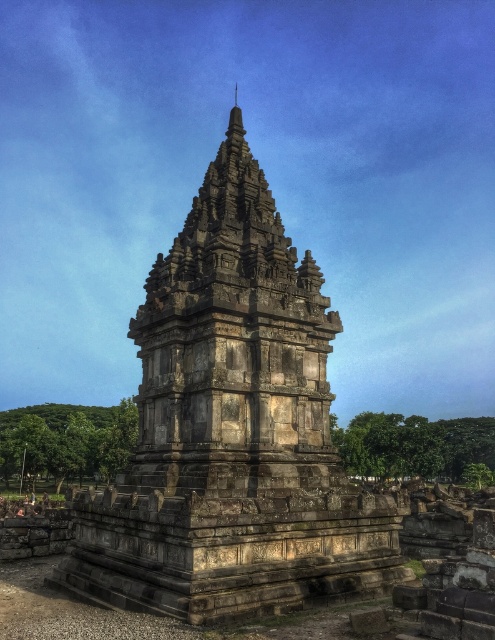
Question: Which of the following is the closest to the observer?

Choices:
 (A) (106, 518)
 (B) (323, 380)

Answer: (A)

Question: From the image, what is the correct spatial relationship of stone temple at center in relation to gray stone tower at center?

Choices:
 (A) above
 (B) below

Answer: (B)

Question: Considering the relative positions of stone temple at center and gray stone tower at center in the image provided, where is stone temple at center located with respect to gray stone tower at center?

Choices:
 (A) below
 (B) above

Answer: (A)

Question: Does stone temple at center have a lesser width compared to gray stone tower at center?

Choices:
 (A) no
 (B) yes

Answer: (A)

Question: Which of the following is the closest to the observer?

Choices:
 (A) (295, 387)
 (B) (171, 470)

Answer: (B)